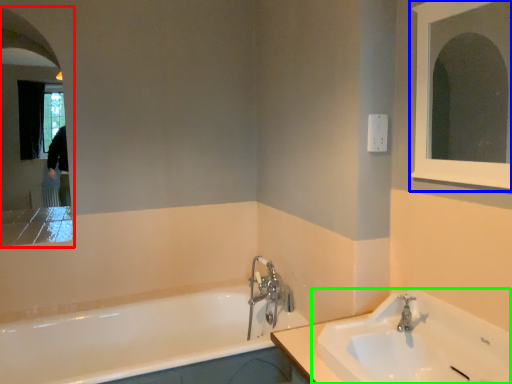
Question: Based on their relative distances, which object is farther from medicine cabinet (highlighted by a red box)? Choose from medicine cabinet (highlighted by a blue box) and sink (highlighted by a green box).

Choices:
 (A) medicine cabinet
 (B) sink

Answer: (A)